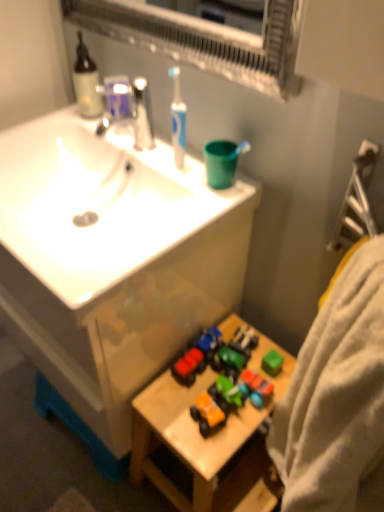
Locate an element on the screen. vacant area on top of wooden toy at lower right (from a real-world perspective) is located at coordinates (221, 398).